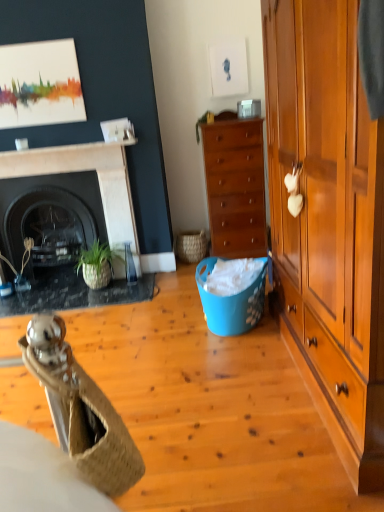
Where is `free space above black marble fireplace at left, positioned as the first fireplace in front-to-back order (from a real-world perspective)`? The image size is (384, 512). free space above black marble fireplace at left, positioned as the first fireplace in front-to-back order (from a real-world perspective) is located at coordinates (55, 154).